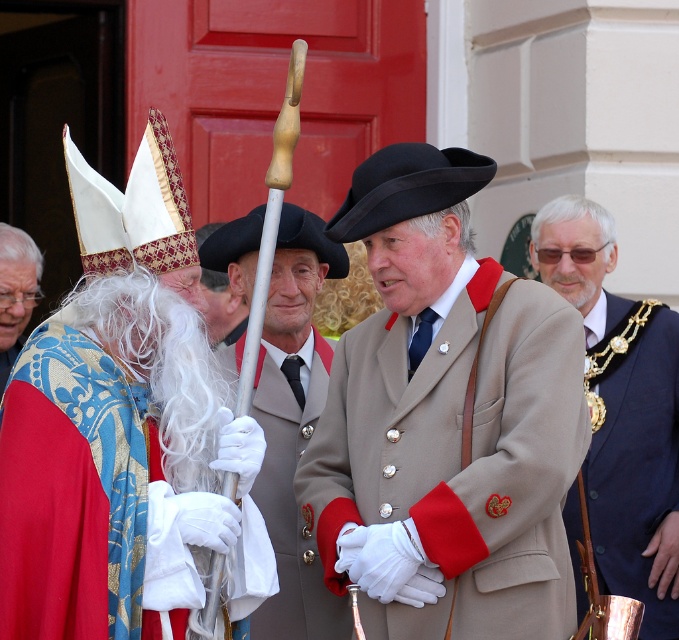
Can you confirm if silver metallic staff at center is taller than blue velvet robe at left?

Yes.

Which is behind, point (234, 220) or point (10, 240)?

Positioned behind is point (234, 220).

Where is `silver metallic staff at center`? This screenshot has height=640, width=679. silver metallic staff at center is located at coordinates (293, 426).

The width and height of the screenshot is (679, 640). Describe the element at coordinates (445, 420) in the screenshot. I see `matte beige coat at center` at that location.

Does point (507, 570) come behind point (234, 348)?

No, it is not.

Find the location of a particular element. matte beige coat at center is located at coordinates (445, 420).

Describe the element at coordinates (621, 412) in the screenshot. I see `gold chain at right` at that location.

Which of these two, gold chain at right or silver metallic staff at center, stands shorter?

silver metallic staff at center

Who is more forward, (589, 282) or (318, 392)?

Positioned in front is point (318, 392).

You are a GUI agent. You are given a task and a screenshot of the screen. Output one action in this format:
    pyautogui.click(x=<x>, y=<y>)
    Task: Click on the gold chain at right
    Image resolution: width=679 pixels, height=640 pixels.
    Given the screenshot: What is the action you would take?
    pyautogui.click(x=621, y=412)